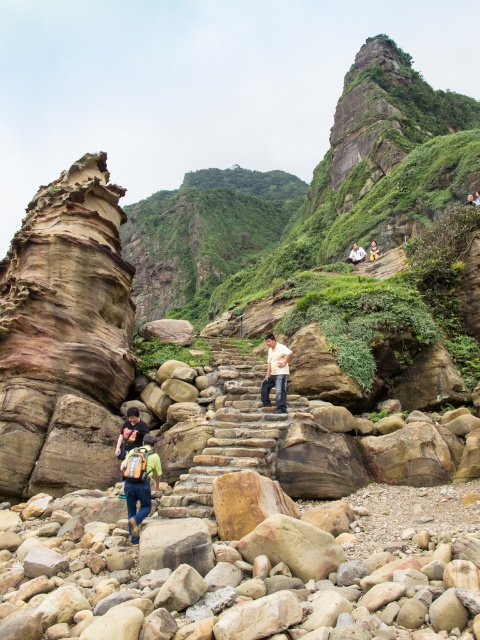
Question: Which point appears closest to the camera in this image?

Choices:
 (A) (351, 260)
 (B) (369, 256)

Answer: (A)

Question: Which object is closer to the camera taking this photo?

Choices:
 (A) green fabric backpack at lower left
 (B) light brown leather jacket at center
 (C) white cotton shirt at center

Answer: (A)

Question: Is white cotton shirt at center in front of light brown leather jacket at center?

Choices:
 (A) no
 (B) yes

Answer: (B)

Question: Can you confirm if green fabric backpack at lower left is wider than light brown wooden bench at upper center?

Choices:
 (A) no
 (B) yes

Answer: (A)

Question: Which of the following is the farthest from the observer?

Choices:
 (A) (147, 477)
 (B) (287, 348)

Answer: (B)

Question: Does white cotton shirt at center appear under light brown wooden bench at upper center?

Choices:
 (A) yes
 (B) no

Answer: (A)